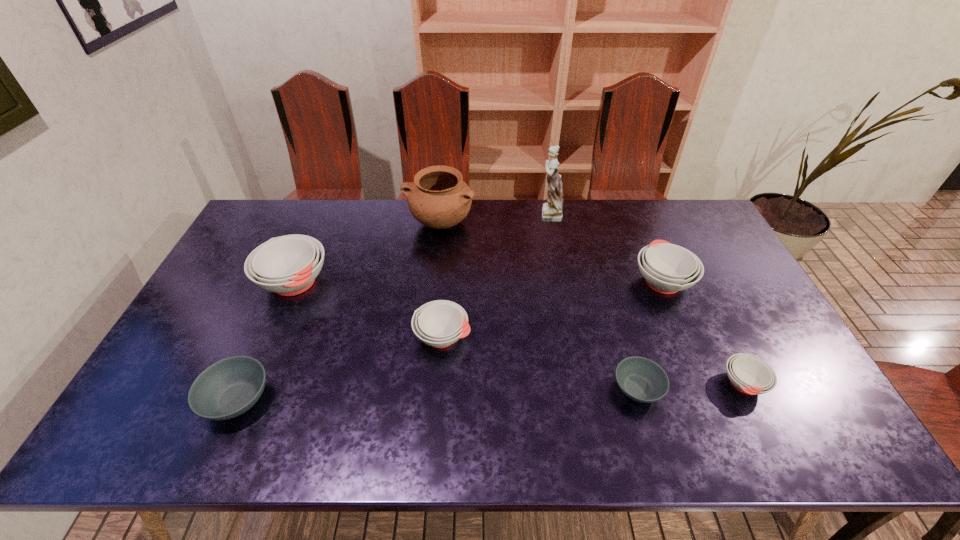
You are a GUI agent. You are given a task and a screenshot of the screen. Output one action in this format:
    pyautogui.click(x=<x>, y=<y>)
    Task: Click on the vacant space that satisfies the following two spatial constraints: 1. on the front-facing side of the tallest object; 2. on the back side of the smallest white soup bowl
    The height and width of the screenshot is (540, 960).
    Given the screenshot: What is the action you would take?
    pyautogui.click(x=580, y=384)

At what (x,y) coordinates should I click in order to perform the action: click on vacant space that satisfies the following two spatial constraints: 1. on the front-facing side of the tallest object; 2. on the left side of the smaller gray soup bowl. Please return your answer as a coordinate pair (x, y). This screenshot has height=540, width=960. Looking at the image, I should click on (581, 388).

Where is `vacant space that satisfies the following two spatial constraints: 1. on the back side of the smallest white soup bowl; 2. on the right side of the left gray soup bowl`? vacant space that satisfies the following two spatial constraints: 1. on the back side of the smallest white soup bowl; 2. on the right side of the left gray soup bowl is located at coordinates (244, 384).

I want to click on vacant region that satisfies the following two spatial constraints: 1. on the front-facing side of the fifth object from left to right; 2. on the right side of the shortest soup bowl, so click(581, 388).

Where is `vacant space that satisfies the following two spatial constraints: 1. on the front-facing side of the tallest object; 2. on the back side of the nearest white soup bowl`? vacant space that satisfies the following two spatial constraints: 1. on the front-facing side of the tallest object; 2. on the back side of the nearest white soup bowl is located at coordinates (580, 384).

The image size is (960, 540). Find the location of `vacant space that satisfies the following two spatial constraints: 1. on the front side of the fourth nearest soup bowl; 2. on the left side of the terracotta pottery`. vacant space that satisfies the following two spatial constraints: 1. on the front side of the fourth nearest soup bowl; 2. on the left side of the terracotta pottery is located at coordinates (428, 336).